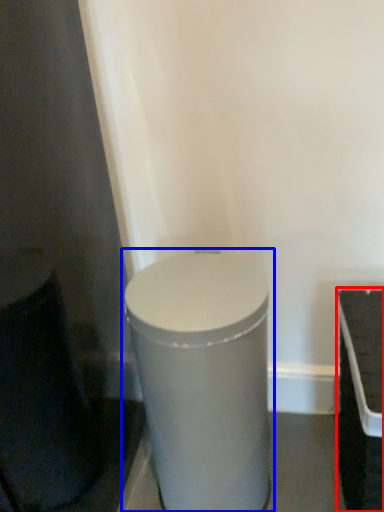
Question: Among these objects, which one is nearest to the camera, table (highlighted by a red box) or waste container (highlighted by a blue box)?

Choices:
 (A) table
 (B) waste container

Answer: (A)